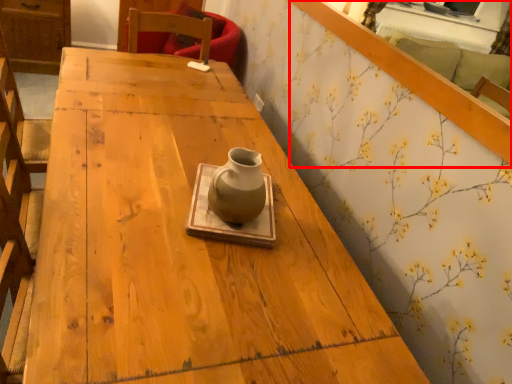
Question: From the image's perspective, what is the correct spatial positioning of mirror (annotated by the red box) in reference to vase?

Choices:
 (A) above
 (B) below

Answer: (A)